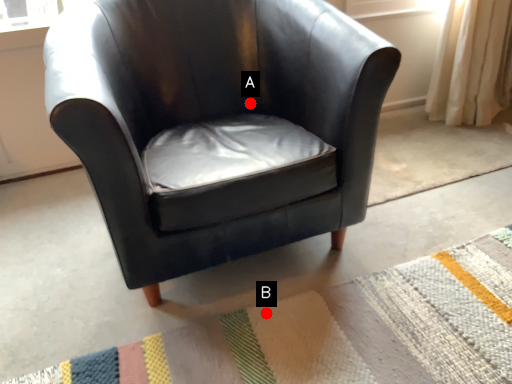
Question: Two points are circled on the image, labeled by A and B beside each circle. Which point is farther to the camera?

Choices:
 (A) A is further
 (B) B is further

Answer: (A)